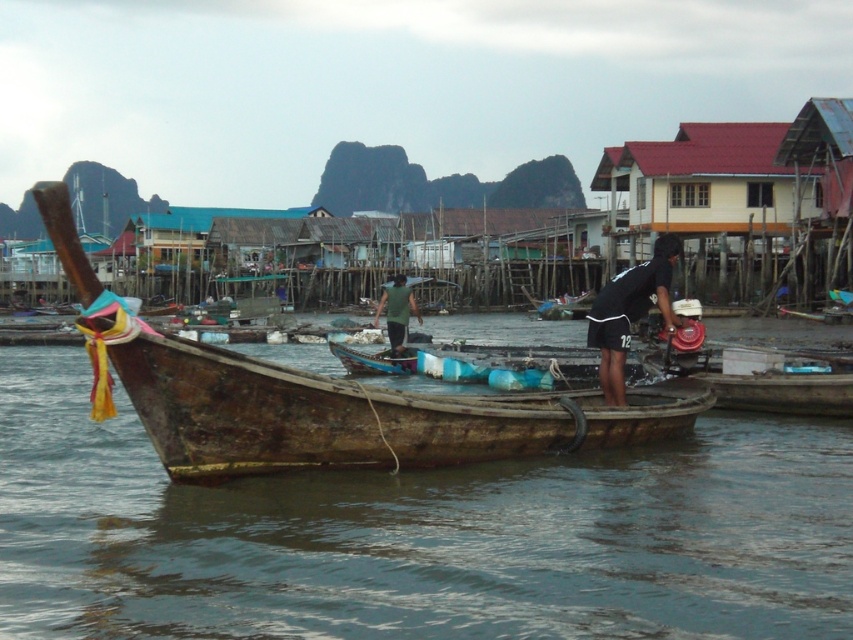
Is point (782, 461) farther from camera compared to point (142, 333)?

Yes.

Is brown wooden boat at center below rusty wood boat at center?

Yes.

Where is `brown wooden boat at center`? The image size is (853, 640). brown wooden boat at center is located at coordinates (416, 534).

Locate an element on the screen. The image size is (853, 640). brown wooden boat at center is located at coordinates (416, 534).

Who is positioned more to the left, brown wooden boat at center or green fabric shirt at center?

Positioned to the left is brown wooden boat at center.

This screenshot has height=640, width=853. What do you see at coordinates (416, 534) in the screenshot?
I see `brown wooden boat at center` at bounding box center [416, 534].

The width and height of the screenshot is (853, 640). I want to click on brown wooden boat at center, so click(x=416, y=534).

Find the location of a particular element. The width and height of the screenshot is (853, 640). rusty wood boat at center is located at coordinates [x=361, y=416].